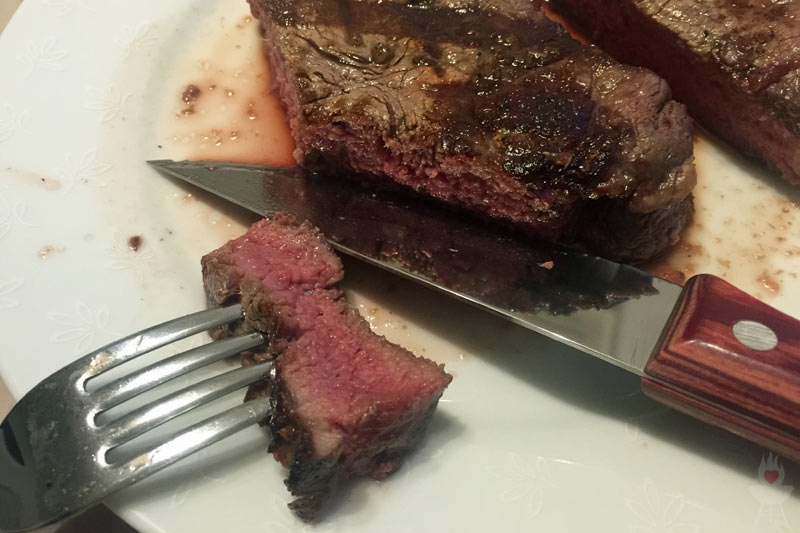
You are a GUI agent. You are given a task and a screenshot of the screen. Output one action in this format:
    pyautogui.click(x=<x>, y=<y>)
    Task: Click on the fork
    The height and width of the screenshot is (533, 800).
    Given the screenshot: What is the action you would take?
    pyautogui.click(x=70, y=428)